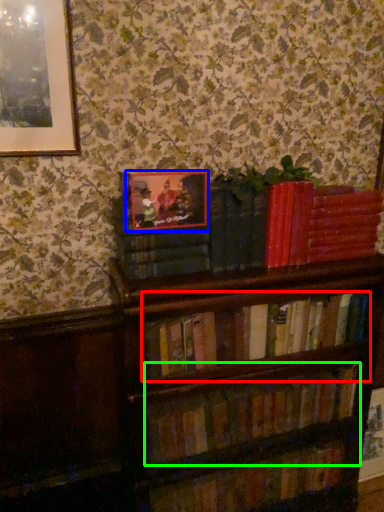
Question: Estimate the real-world distances between objects in this image. Which object is closer to book (highlighted by a red box), picture frame (highlighted by a blue box) or book (highlighted by a green box)?

Choices:
 (A) picture frame
 (B) book

Answer: (B)